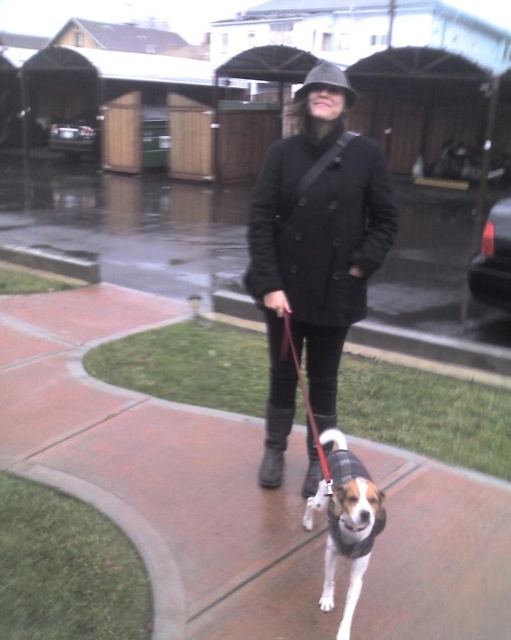
Question: Which object is positioned farthest from the brown concrete sidewalk at center?

Choices:
 (A) white nylon leash at center
 (B) matte black coat at center

Answer: (B)

Question: Can you confirm if matte black coat at center is positioned to the right of white and brown fur at center?

Choices:
 (A) no
 (B) yes

Answer: (A)

Question: Is matte black coat at center bigger than white and brown fur at center?

Choices:
 (A) yes
 (B) no

Answer: (A)

Question: Considering the real-world distances, which object is farthest from the matte black coat at center?

Choices:
 (A) white nylon leash at center
 (B) brown concrete sidewalk at center

Answer: (B)

Question: Which of the following is the farthest from the observer?

Choices:
 (A) (350, 611)
 (B) (251, 262)

Answer: (B)

Question: In this image, where is brown concrete sidewalk at center located relative to white nylon leash at center?

Choices:
 (A) above
 (B) below

Answer: (B)